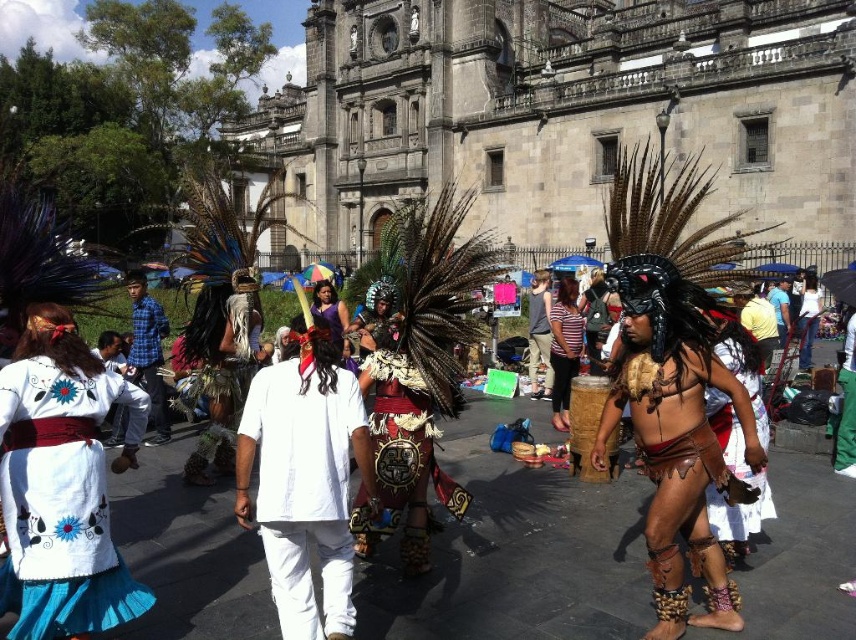
Between brown leather headdress at center and blue plaid shirt at center, which one is positioned higher?

Positioned higher is blue plaid shirt at center.

Who is positioned more to the right, brown leather headdress at center or blue plaid shirt at center?

From the viewer's perspective, brown leather headdress at center appears more on the right side.

At what (x,y) coordinates should I click in order to perform the action: click on brown leather headdress at center. Please return your answer as a coordinate pair (x, y). The width and height of the screenshot is (856, 640). Looking at the image, I should click on 676,435.

Can you confirm if white cotton shirt at center is bigger than striped fabric skirt at center?

Indeed, white cotton shirt at center has a larger size compared to striped fabric skirt at center.

Does white cotton shirt at center appear on the right side of striped fabric skirt at center?

Incorrect, white cotton shirt at center is not on the right side of striped fabric skirt at center.

Locate an element on the screen. The height and width of the screenshot is (640, 856). white cotton shirt at center is located at coordinates (302, 486).

Find the location of a particular element. This screenshot has height=640, width=856. white cotton shirt at center is located at coordinates 302,486.

Between matte brown drum at center and brown leather drum at center, which one is positioned lower?

brown leather drum at center is below.

Looking at this image, who is more forward, (535, 353) or (810, 275)?

Point (810, 275) is more forward.

The height and width of the screenshot is (640, 856). Identify the location of matte brown drum at center. (539, 330).